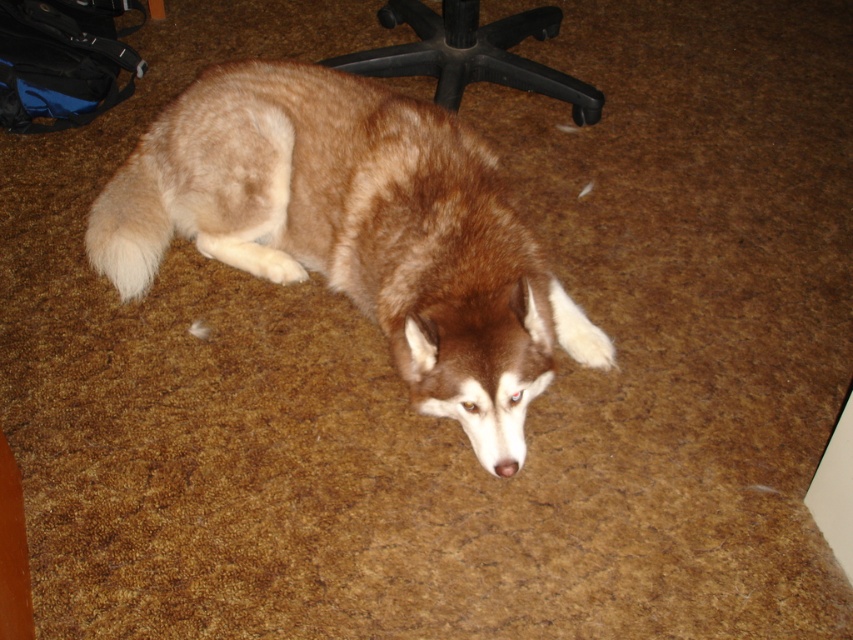
You are standing in a room with a brown fur dog at center. If you want to place a small toy exactly where the dog is currently lying, what coordinates should you use?

The coordinates for the brown fur dog at center are at point (357, 230), so you should place the small toy at those coordinates.

From the picture: You are a delivery person entering a room and see the brown fur dog at center and the black plastic swivel chair at upper center. Which object is taller?

The brown fur dog at center is much taller than the black plastic swivel chair at upper center.